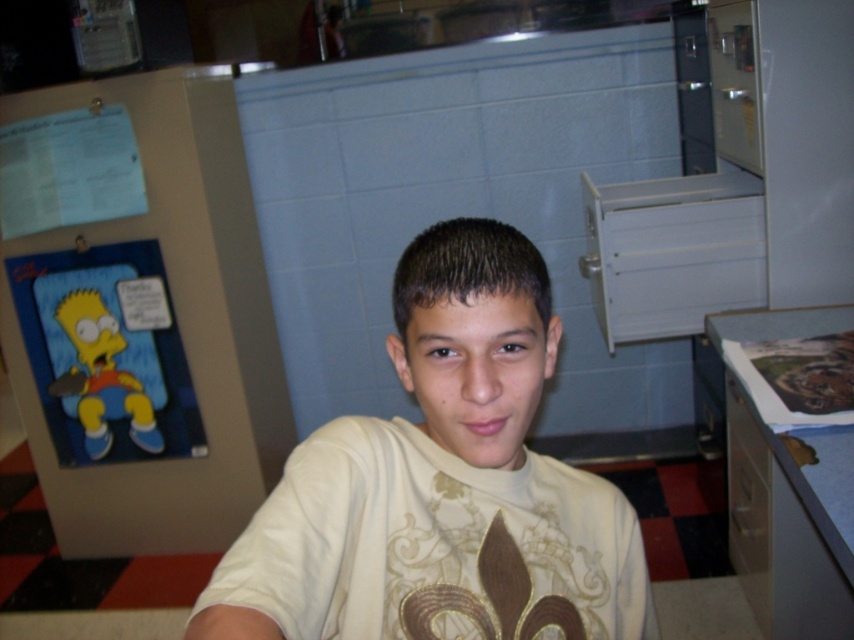
Is blue cardboard poster at left below white matte shirt at center?

Actually, blue cardboard poster at left is above white matte shirt at center.

You are a GUI agent. You are given a task and a screenshot of the screen. Output one action in this format:
    pyautogui.click(x=<x>, y=<y>)
    Task: Click on the blue cardboard poster at left
    
    Given the screenshot: What is the action you would take?
    pyautogui.click(x=139, y=310)

What do you see at coordinates (139, 310) in the screenshot? I see `blue cardboard poster at left` at bounding box center [139, 310].

The width and height of the screenshot is (854, 640). What are the coordinates of `blue cardboard poster at left` in the screenshot? It's located at (139, 310).